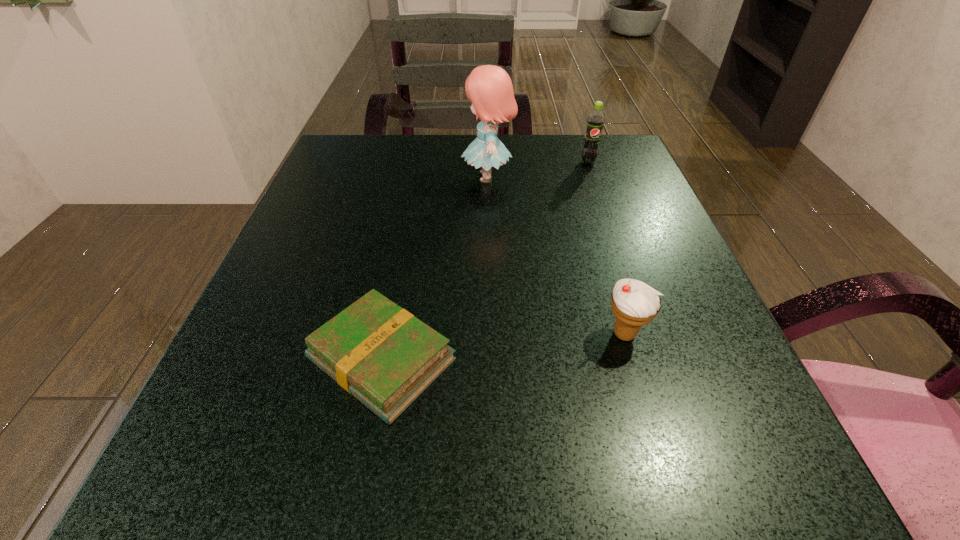
Identify the location of empty space that is in between the book and the doll. (435, 268).

Locate an element on the screen. The height and width of the screenshot is (540, 960). vacant area that lies between the book and the second shortest object is located at coordinates (503, 347).

Where is `free space between the book and the soda`? free space between the book and the soda is located at coordinates (485, 261).

Find the location of a particular element. vacant area between the soda and the doll is located at coordinates (538, 170).

This screenshot has height=540, width=960. What are the coordinates of `object that is the third closest to the icecream` in the screenshot? It's located at (595, 121).

Locate an element on the screen. the second closest object to the third shortest object is located at coordinates (634, 303).

At what (x,y) coordinates should I click in order to perform the action: click on vacant region that satisfies the following two spatial constraints: 1. on the front-facing side of the doll; 2. on the left side of the icecream. Please return your answer as a coordinate pair (x, y). The width and height of the screenshot is (960, 540). Looking at the image, I should click on (492, 334).

This screenshot has width=960, height=540. In order to click on vacant area in the image that satisfies the following two spatial constraints: 1. on the back side of the icecream; 2. on the front-facing side of the tallest object in this screenshot , I will do `click(578, 177)`.

This screenshot has height=540, width=960. Identify the location of free spot that satisfies the following two spatial constraints: 1. on the back side of the book; 2. on the right side of the icecream. (387, 334).

Where is `free space that satisfies the following two spatial constraints: 1. on the front-facing side of the tallest object; 2. on the back side of the third tallest object`? Image resolution: width=960 pixels, height=540 pixels. free space that satisfies the following two spatial constraints: 1. on the front-facing side of the tallest object; 2. on the back side of the third tallest object is located at coordinates (492, 334).